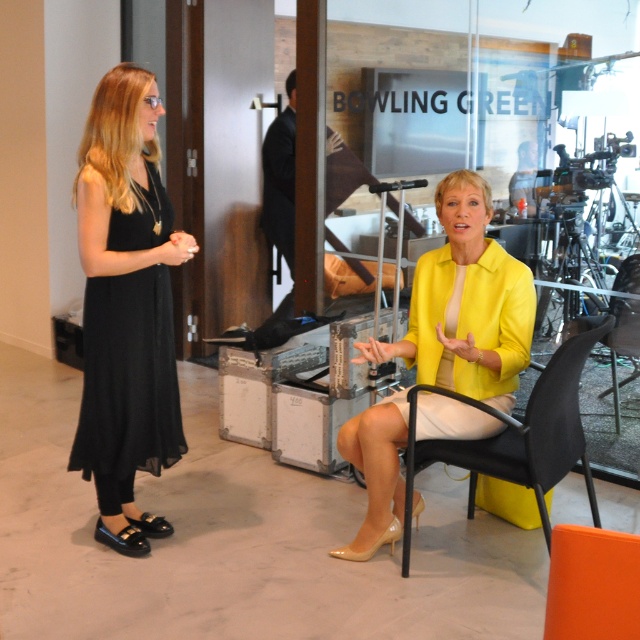
Question: Does black chiffon dress at left appear over black plastic chair at lower right?

Choices:
 (A) no
 (B) yes

Answer: (B)

Question: Which of the following is the farthest from the observer?

Choices:
 (A) black plastic chair at center
 (B) black plastic chair at lower right

Answer: (B)

Question: Which object is the closest to the black chiffon dress at left?

Choices:
 (A) black plastic chair at lower right
 (B) black plastic chair at center

Answer: (B)

Question: Is yellow matte blazer at center above black plastic chair at lower right?

Choices:
 (A) yes
 (B) no

Answer: (B)

Question: From the image, what is the correct spatial relationship of yellow matte blazer at center in relation to black plastic chair at lower right?

Choices:
 (A) below
 (B) above

Answer: (A)

Question: Which is farther from the black plastic chair at lower right?

Choices:
 (A) black plastic chair at center
 (B) yellow matte blazer at center
 (C) black chiffon dress at left

Answer: (C)